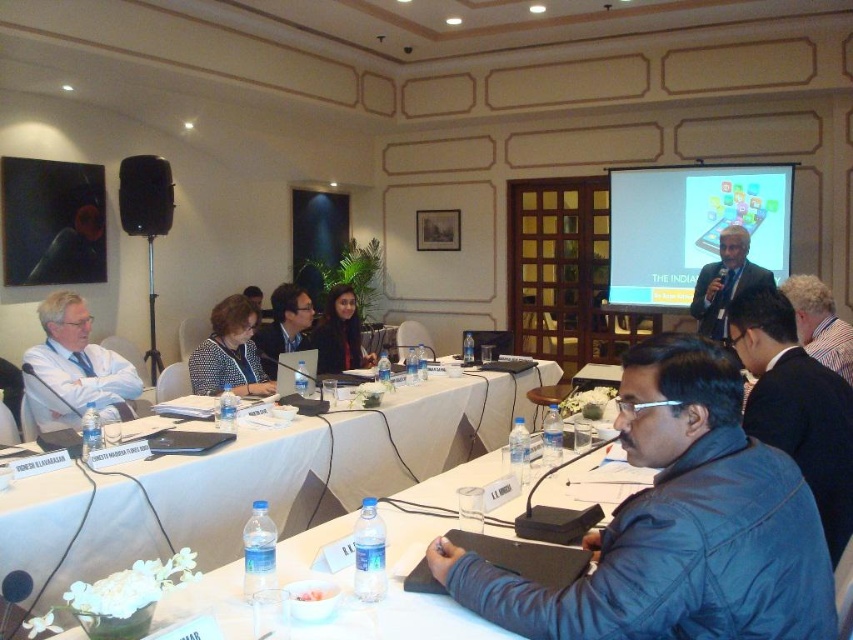
You are attending a virtual meeting and need to share your screen. You have a matte black laptop at left and a matte black screen at upper right. Which device should you use to share your screen to the larger display?

You should use the matte black screen at upper right because it is bigger than the matte black laptop at left, making it more suitable for sharing during a virtual meeting.

In the scene shown: You are attending a meeting and notice two people sitting at the tables. One is wearing a blue leather jacket at lower right and the other a white shirt at left. From your perspective at the entrance, which person is closer to you?

The blue leather jacket at lower right is closer to you because it is in front of the white shirt at left.